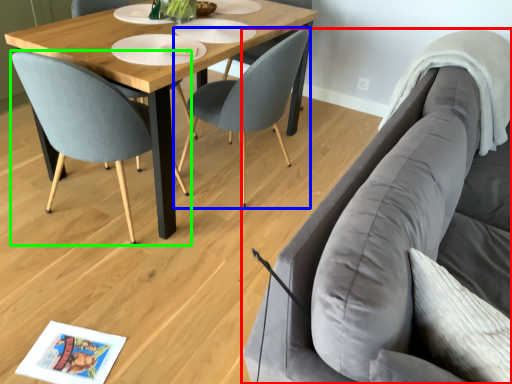
Question: Which is farther away from studio couch (highlighted by a red box)? chair (highlighted by a blue box) or chair (highlighted by a green box)?

Choices:
 (A) chair
 (B) chair

Answer: (B)